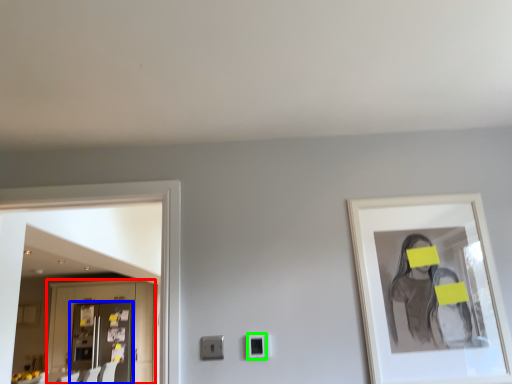
Question: Which object is the farthest from cabinetry (highlighted by a red box)? Choose among these: door (highlighted by a blue box) or electric outlet (highlighted by a green box).

Choices:
 (A) door
 (B) electric outlet

Answer: (B)